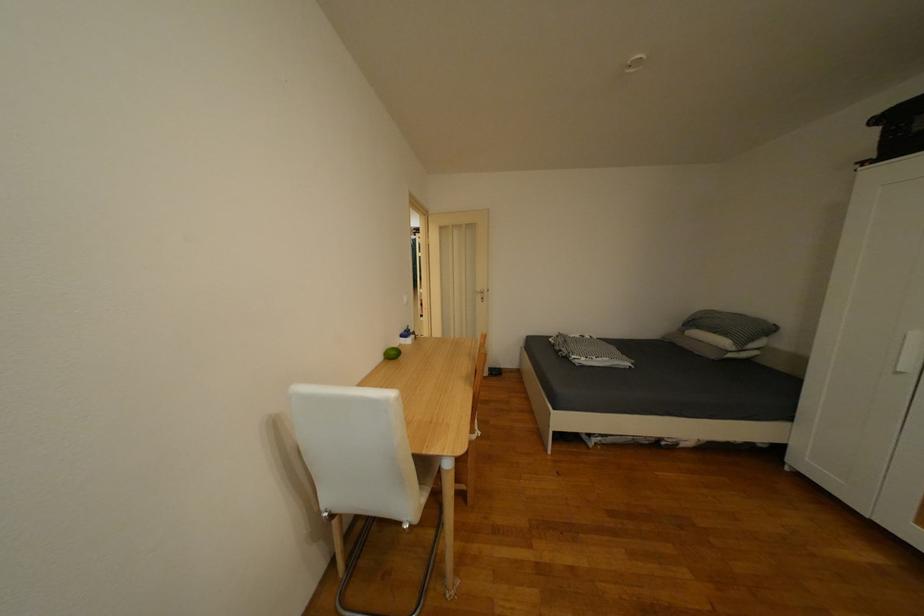
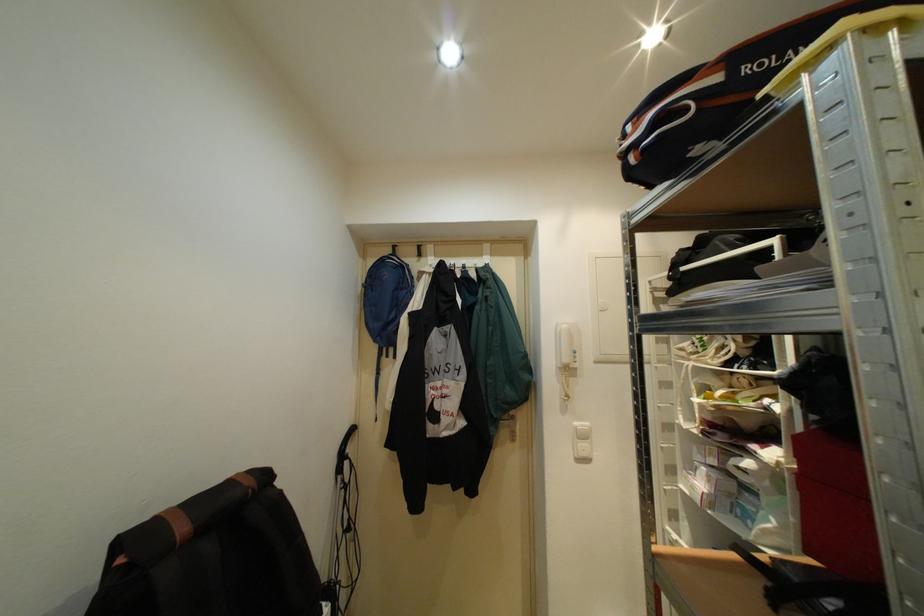
Question: In a continuous first-person perspective shot, in which direction is the camera moving?

Choices:
 (A) Left
 (B) Right
 (C) Forward
 (D) Backward

Answer: (C)